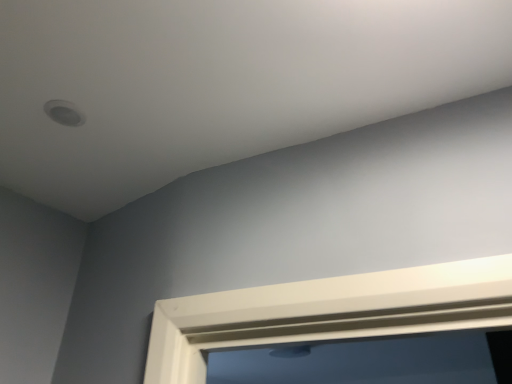
What do you see at coordinates (64, 113) in the screenshot? I see `white matte light fixture at upper left` at bounding box center [64, 113].

Locate an element on the screen. This screenshot has width=512, height=384. white matte light fixture at upper left is located at coordinates (64, 113).

Find the location of a particular element. The height and width of the screenshot is (384, 512). white matte light fixture at upper left is located at coordinates click(x=64, y=113).